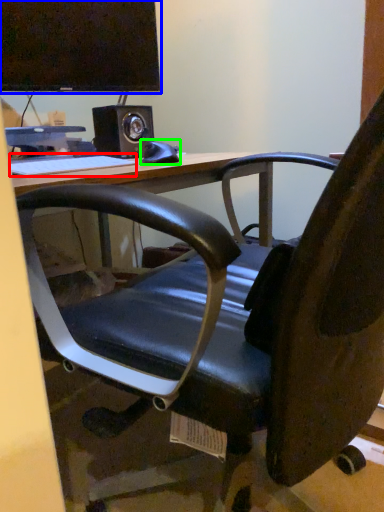
Question: Estimate the real-world distances between objects in this image. Which object is closer to keyboard (highlighted by a red box), computer monitor (highlighted by a blue box) or equipment (highlighted by a green box)?

Choices:
 (A) computer monitor
 (B) equipment

Answer: (B)